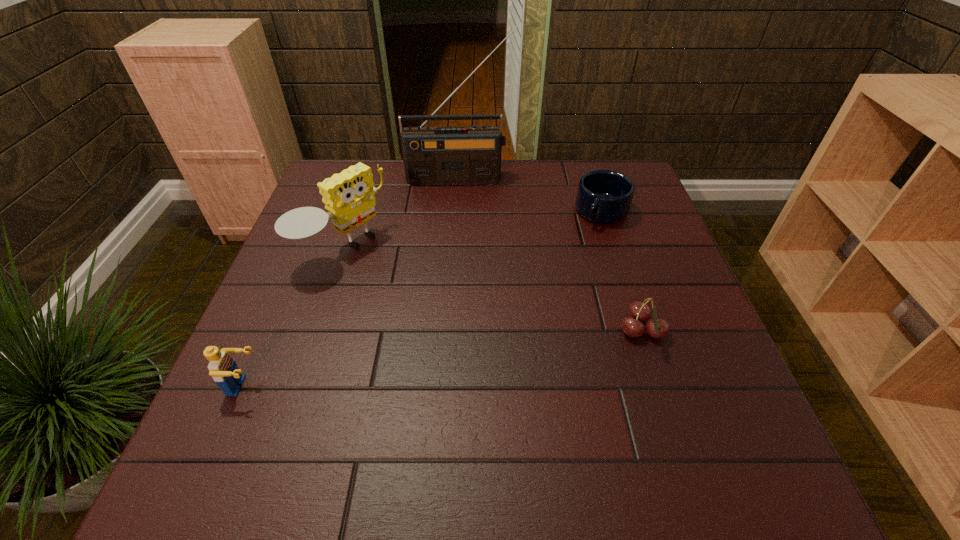
At what (x,y) coordinates should I click in order to perform the action: click on free space located 0.180m with the handle on the side of the mug. Please return your answer as a coordinate pair (x, y). This screenshot has width=960, height=540. Looking at the image, I should click on (566, 267).

Find the location of a particular element. The image size is (960, 540). free space located with the handle on the side of the mug is located at coordinates (545, 298).

The image size is (960, 540). I want to click on free region located 0.140m on the front-facing side of the sponge, so click(x=409, y=296).

Identify the location of vacant space located 0.290m on the front-facing side of the sponge. (458, 330).

Find the location of a particular element. vacant position located on the front-facing side of the sponge is located at coordinates (392, 285).

Where is `free region located 0.380m on the front-facing side of the radio receiver`? The width and height of the screenshot is (960, 540). free region located 0.380m on the front-facing side of the radio receiver is located at coordinates (460, 274).

Where is `vacant space situated on the front-facing side of the radio receiver`? vacant space situated on the front-facing side of the radio receiver is located at coordinates (460, 220).

At what (x,y) coordinates should I click in order to perform the action: click on free space located 0.100m on the front-facing side of the radio receiver. Please return your answer as a coordinate pair (x, y). Looking at the image, I should click on (460, 205).

Identify the location of mug that is at the far edge. Image resolution: width=960 pixels, height=540 pixels. (603, 196).

Locate an element on the screen. radio receiver positioned at the far edge is located at coordinates (469, 154).